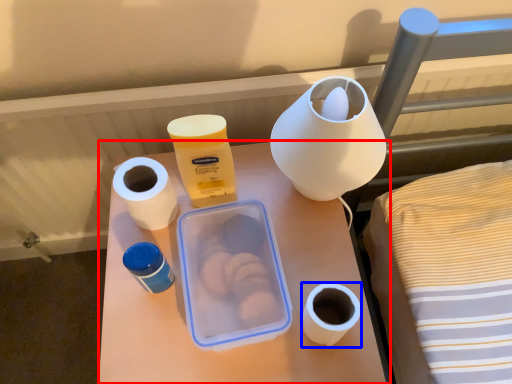
Question: Which of the following is the farthest to the observer, table (highlighted by a red box) or toilet paper (highlighted by a blue box)?

Choices:
 (A) table
 (B) toilet paper

Answer: (A)